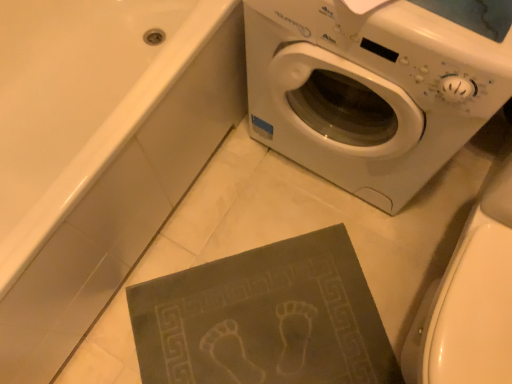
Find the location of `vacant space in white glossy toilet bowl at lower right (from a real-world perspective)`. vacant space in white glossy toilet bowl at lower right (from a real-world perspective) is located at coordinates (418, 284).